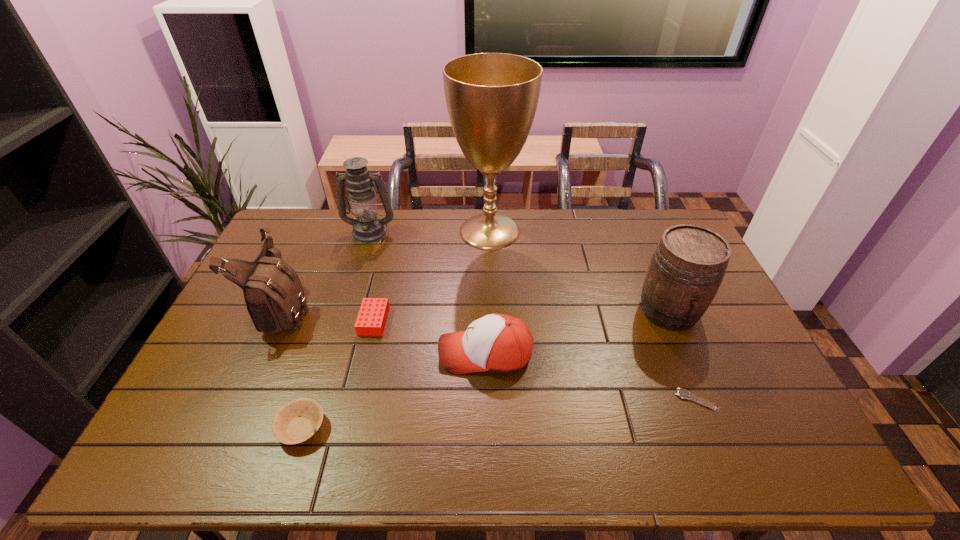
Identify the location of object located at the near edge. (295, 422).

The width and height of the screenshot is (960, 540). Find the location of `object that is positioned at the left edge`. object that is positioned at the left edge is located at coordinates (274, 296).

Locate an element on the screen. cider at the right edge is located at coordinates (688, 265).

The height and width of the screenshot is (540, 960). In order to click on watch situated at the right edge in this screenshot , I will do `click(682, 393)`.

This screenshot has height=540, width=960. In order to click on free space at the far edge of the desktop in this screenshot , I will do `click(435, 225)`.

You are a GUI agent. You are given a task and a screenshot of the screen. Output one action in this format:
    pyautogui.click(x=<x>, y=<y>)
    Task: Click on the vacant position at the left edge of the desktop
    
    Given the screenshot: What is the action you would take?
    pyautogui.click(x=221, y=347)

You are a GUI agent. You are given a task and a screenshot of the screen. Output one action in this format:
    pyautogui.click(x=<x>, y=<y>)
    Task: Click on the free space at the right edge
    The width and height of the screenshot is (960, 540).
    Given the screenshot: What is the action you would take?
    pyautogui.click(x=761, y=379)

The width and height of the screenshot is (960, 540). I want to click on vacant space at the far left corner, so pyautogui.click(x=320, y=221).

I want to click on vacant space at the near left corner of the desktop, so click(x=180, y=434).

The width and height of the screenshot is (960, 540). I want to click on free space at the far right corner, so click(x=668, y=219).